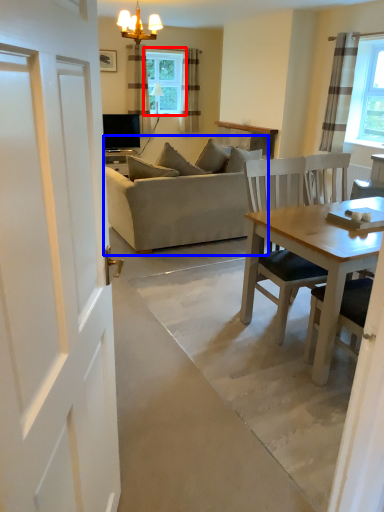
Question: Which object appears closest to the camera in this image, window (highlighted by a red box) or studio couch (highlighted by a blue box)?

Choices:
 (A) window
 (B) studio couch

Answer: (B)